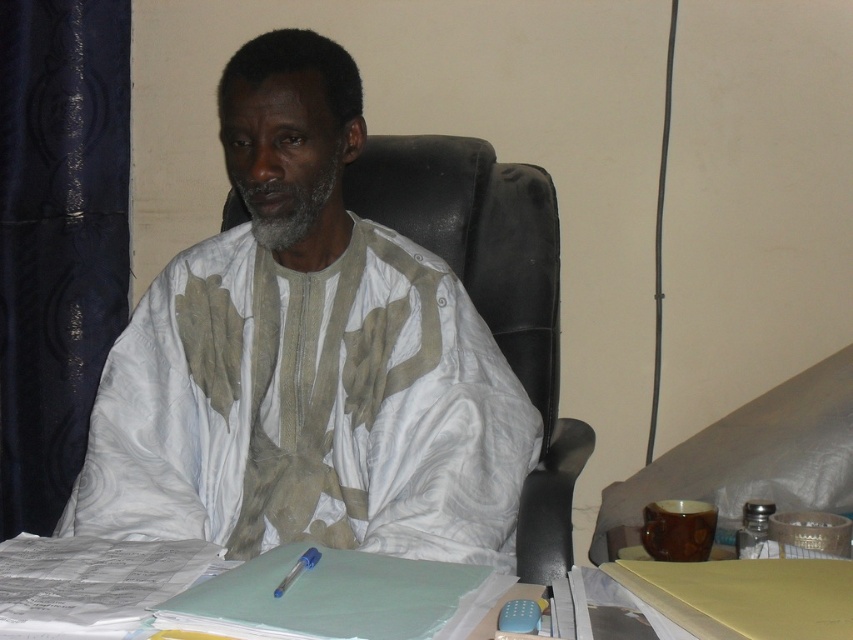
Which is more to the right, white cotton shirt at center or white paper at lower center?

From the viewer's perspective, white paper at lower center appears more on the right side.

The width and height of the screenshot is (853, 640). Find the location of `white cotton shirt at center`. white cotton shirt at center is located at coordinates (305, 358).

Locate an element on the screen. This screenshot has width=853, height=640. white cotton shirt at center is located at coordinates (305, 358).